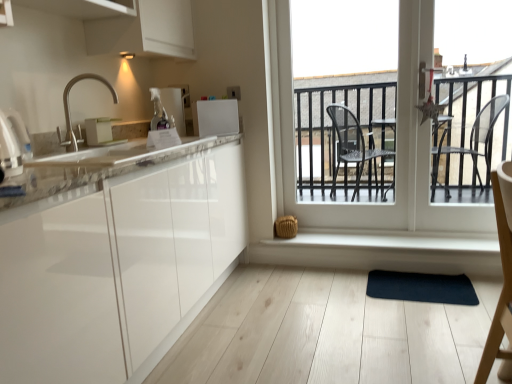
Locate an element on the screen. The height and width of the screenshot is (384, 512). free space above dark blue rubber yoga mat at center (from a real-world perspective) is located at coordinates (413, 281).